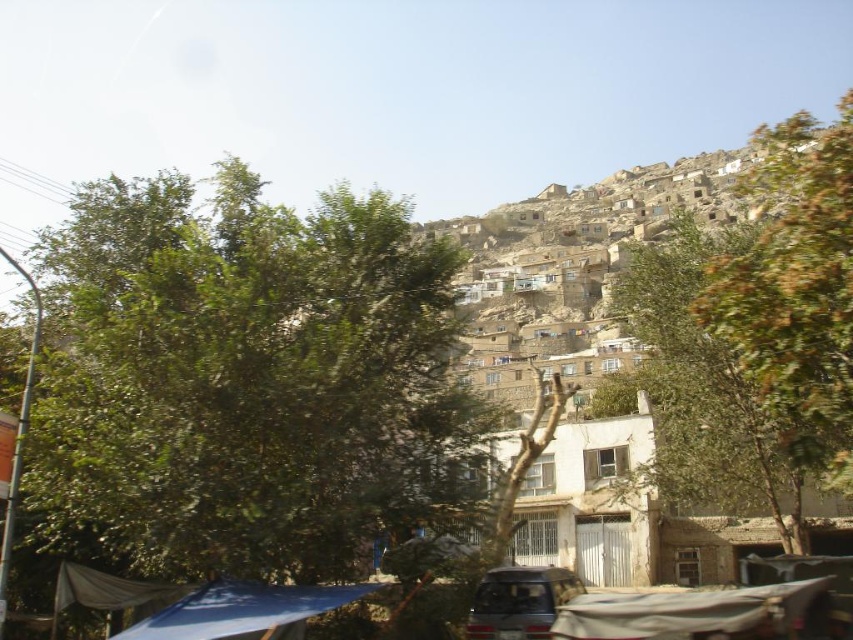
Question: Can you confirm if blue fabric canopy at lower center is positioned below metallic gray car at lower center?

Choices:
 (A) yes
 (B) no

Answer: (B)

Question: Which of the following is the farthest from the observer?

Choices:
 (A) green leafy tree at center
 (B) beige fabric canopy at lower right
 (C) blue fabric canopy at lower center

Answer: (A)

Question: Which point appears farthest from the camera in this image?

Choices:
 (A) (212, 596)
 (B) (682, 285)

Answer: (B)

Question: Considering the relative positions of beige fabric canopy at lower right and blue fabric canopy at lower center in the image provided, where is beige fabric canopy at lower right located with respect to blue fabric canopy at lower center?

Choices:
 (A) left
 (B) right

Answer: (B)

Question: Where is green leafy tree at center located in relation to green leafy tree at upper right in the image?

Choices:
 (A) right
 (B) left

Answer: (B)

Question: Which point is farther to the camera?

Choices:
 (A) (811, 472)
 (B) (708, 620)

Answer: (A)